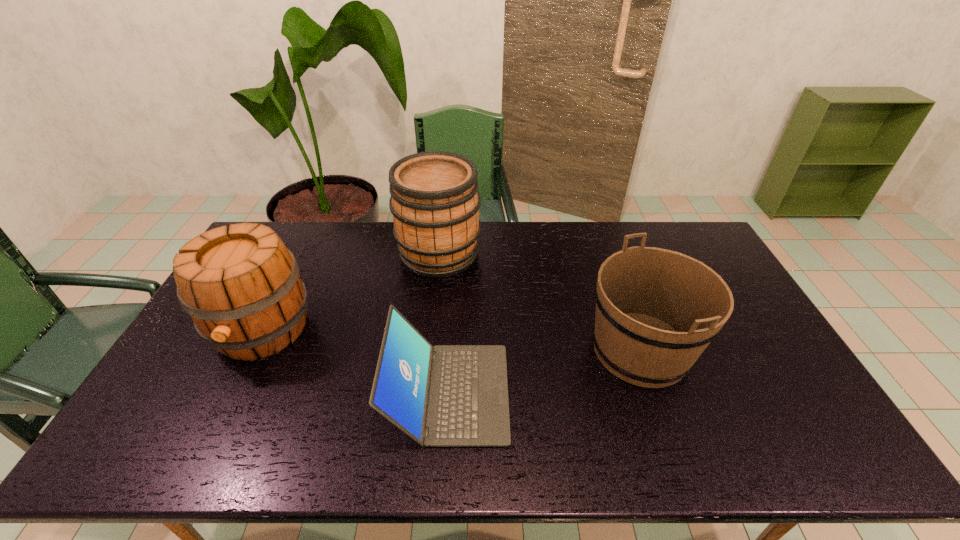
In order to click on unoccupied position between the laptop computer and the nearer cider in this screenshot , I will do `click(355, 361)`.

Where is `free space between the right cider and the bucket`? Image resolution: width=960 pixels, height=540 pixels. free space between the right cider and the bucket is located at coordinates (540, 301).

This screenshot has width=960, height=540. Find the location of `free point between the nearer cider and the right cider`. free point between the nearer cider and the right cider is located at coordinates (350, 291).

The image size is (960, 540). I want to click on free space between the bucket and the nearer cider, so click(451, 340).

Locate an element on the screen. free space between the shortest object and the nearer cider is located at coordinates (355, 361).

This screenshot has height=540, width=960. What are the coordinates of `vacant area that lies between the laptop computer and the left cider` in the screenshot? It's located at (355, 361).

You are a GUI agent. You are given a task and a screenshot of the screen. Output one action in this format:
    pyautogui.click(x=<x>, y=<y>)
    Task: Click on the blank region between the rightmost object and the laptop computer
    The width and height of the screenshot is (960, 540).
    Given the screenshot: What is the action you would take?
    [x=545, y=372]

Image resolution: width=960 pixels, height=540 pixels. What are the coordinates of `vacant area that lies between the leftmost object and the farther cider` in the screenshot? It's located at (350, 291).

Find the location of a particular element. The width and height of the screenshot is (960, 540). object that is the closest to the laptop computer is located at coordinates (657, 310).

I want to click on object that is the second closest one to the shortest object, so click(x=241, y=286).